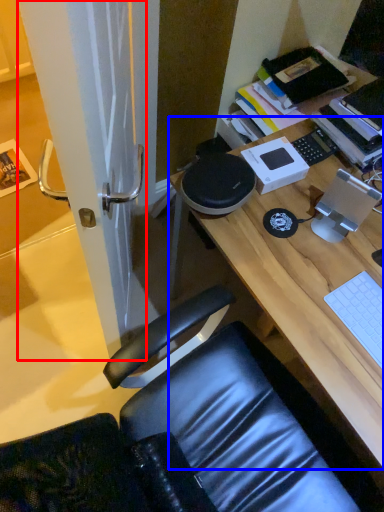
Question: Which object is closer to the camera taking this photo, screen door (highlighted by a red box) or desk (highlighted by a blue box)?

Choices:
 (A) screen door
 (B) desk

Answer: (A)